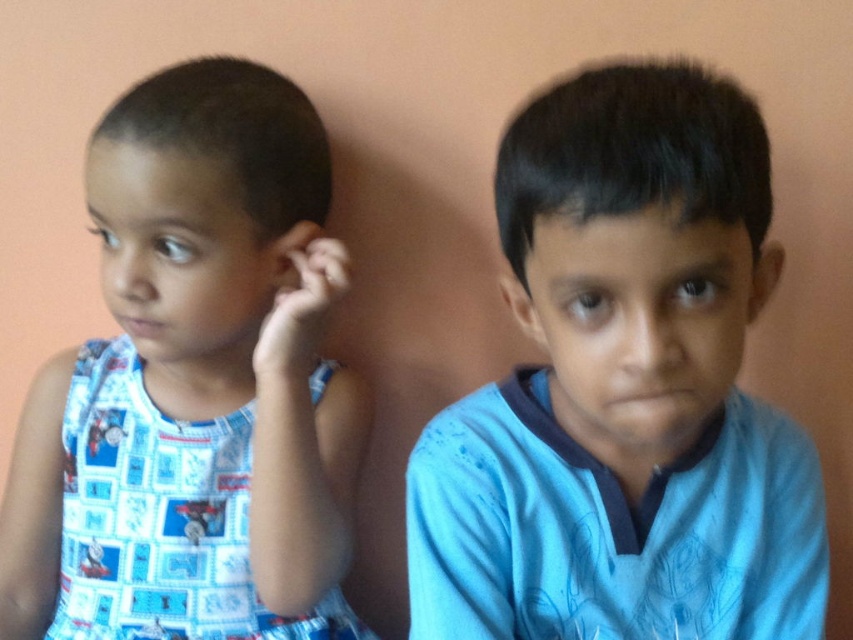
Is blue cotton shirt at center bigger than blue printed dress at left?

No, blue cotton shirt at center is not bigger than blue printed dress at left.

Who is lower down, blue cotton shirt at center or blue printed dress at left?

blue printed dress at left

Find the location of a particular element. blue cotton shirt at center is located at coordinates pos(624,392).

Describe the element at coordinates (611, 529) in the screenshot. The height and width of the screenshot is (640, 853). I see `blue cotton shirt at right` at that location.

Does blue cotton shirt at right have a greater width compared to smooth skin ear at center?

Yes, blue cotton shirt at right is wider than smooth skin ear at center.

Which is in front, point (672, 609) or point (517, 321)?

Point (672, 609) is more forward.

The width and height of the screenshot is (853, 640). Find the location of `blue cotton shirt at right`. blue cotton shirt at right is located at coordinates (611, 529).

Does matte skin ear at left have a larger size compared to matte skin ear at right?

Incorrect, matte skin ear at left is not larger than matte skin ear at right.

Does point (281, 282) lie behind point (763, 275)?

Yes, point (281, 282) is behind point (763, 275).

At what (x,y) coordinates should I click in order to perform the action: click on matte skin ear at left. Please return your answer as a coordinate pair (x, y). Looking at the image, I should click on (289, 253).